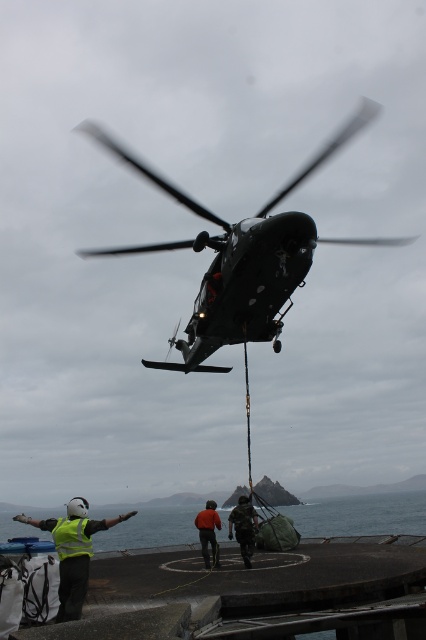
You are a pilot flying the military helicopter. You need to determine which of the two points, point (60, 588) or point (213, 552), is closer to your current position. Based on the scene, which point should you aim for?

Point (60, 588) is closer to the camera than point (213, 552), so you should aim for point (60, 588).

You are a crew member on the ship and need to ensure the helicopter can land safely. Considering the dark matte helicopter at center and the reflective yellow vest at lower left, which object is wider and might require more space for landing clearance?

The dark matte helicopter at center is wider than the reflective yellow vest at lower left, so it requires more space for landing clearance.